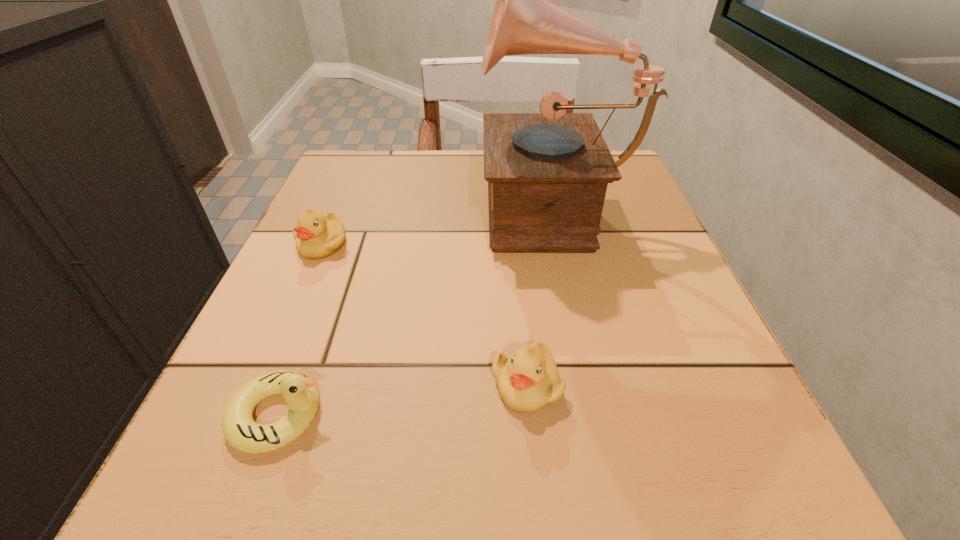
At what (x,y) coordinates should I click in order to perform the action: click on object that is at the right edge. Please return your answer as a coordinate pair (x, y). The height and width of the screenshot is (540, 960). Looking at the image, I should click on (547, 173).

Where is `object that is at the near left corner`? This screenshot has height=540, width=960. object that is at the near left corner is located at coordinates (300, 393).

The width and height of the screenshot is (960, 540). Identify the location of object that is at the far right corner. (547, 173).

I want to click on vacant space at the near edge of the desktop, so click(378, 507).

You are a GUI agent. You are given a task and a screenshot of the screen. Output one action in this format:
    pyautogui.click(x=<x>, y=<y>)
    Task: Click on the free space at the left edge
    This screenshot has height=540, width=960.
    Given the screenshot: What is the action you would take?
    pyautogui.click(x=358, y=313)

The height and width of the screenshot is (540, 960). What are the coordinates of `vacant position at the right edge of the desktop` in the screenshot? It's located at [733, 430].

This screenshot has width=960, height=540. I want to click on vacant space at the far left corner of the desktop, so click(x=376, y=161).

In the image, there is a desktop. Where is `free space at the near left corner`? free space at the near left corner is located at coordinates (265, 509).

The image size is (960, 540). I want to click on free spot at the near right corner of the desktop, so click(x=697, y=516).

Identify the location of vacant space in between the record player and the rightmost duckling. Image resolution: width=960 pixels, height=540 pixels. (540, 295).